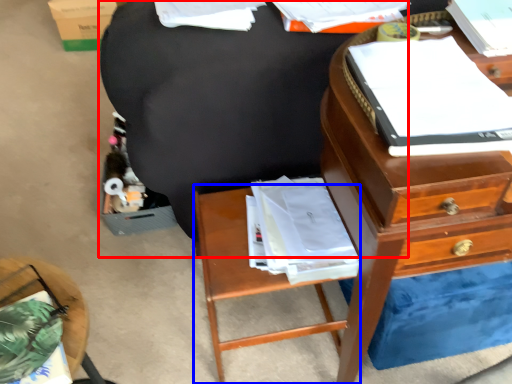
Question: Which object is closer to the camera taking this photo, bean bag chair (highlighted by a red box) or nightstand (highlighted by a blue box)?

Choices:
 (A) bean bag chair
 (B) nightstand

Answer: (A)